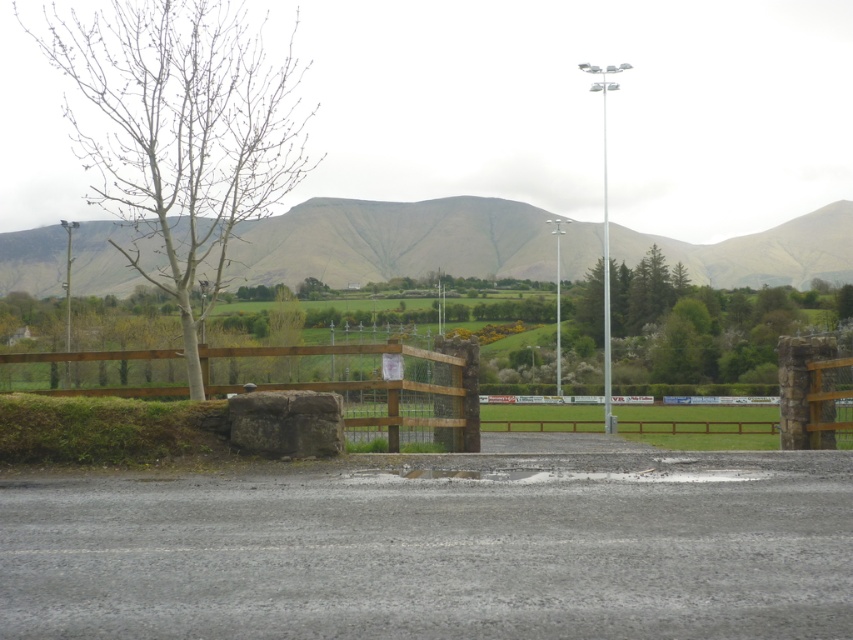
Question: Does green grassy hill at upper center appear on the right side of brown wooden fence at lower left?

Choices:
 (A) no
 (B) yes

Answer: (A)

Question: Observing the image, what is the correct spatial positioning of bare wood tree at left in reference to green grassy hill at upper center?

Choices:
 (A) above
 (B) below

Answer: (A)

Question: Which of these objects is positioned farthest from the brown wooden fence at lower left?

Choices:
 (A) bare wood tree at left
 (B) green grassy hill at upper center

Answer: (B)

Question: Is the position of bare wood tree at left more distant than that of green grassy hill at upper center?

Choices:
 (A) no
 (B) yes

Answer: (A)

Question: Which is farther from the bare wood tree at left?

Choices:
 (A) brown wooden fence at lower left
 (B) green grassy hill at upper center

Answer: (A)

Question: Considering the real-world distances, which object is closest to the brown wooden fence at lower left?

Choices:
 (A) green grassy hill at upper center
 (B) bare wood tree at left

Answer: (B)